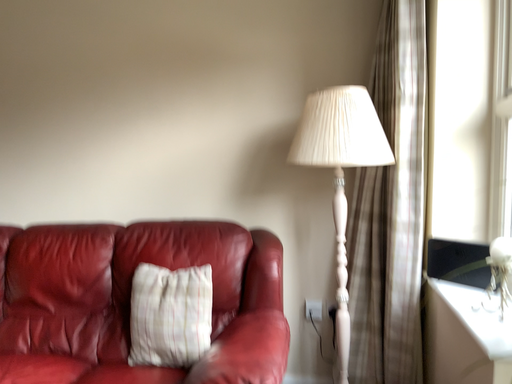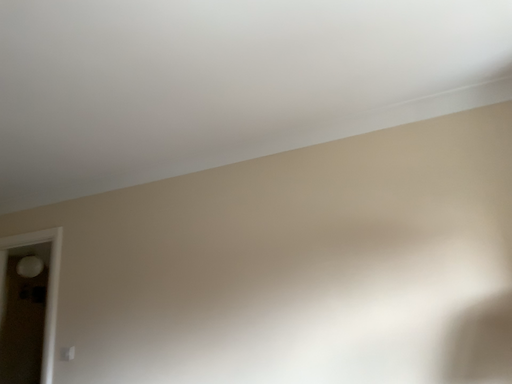
Question: How did the camera likely rotate when shooting the video?

Choices:
 (A) rotated right
 (B) rotated left

Answer: (B)